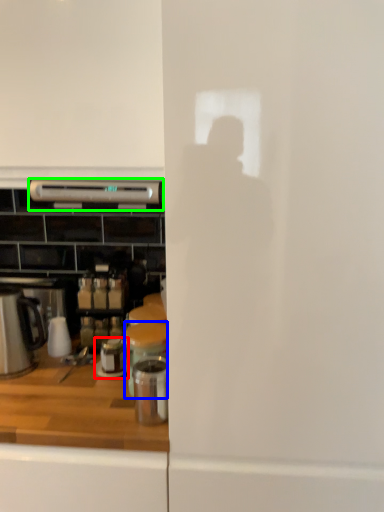
Question: Estimate the real-world distances between objects in this image. Which object is closer to appliance (highlighted by a red box), appliance (highlighted by a blue box) or kitchen appliance (highlighted by a green box)?

Choices:
 (A) appliance
 (B) kitchen appliance

Answer: (A)